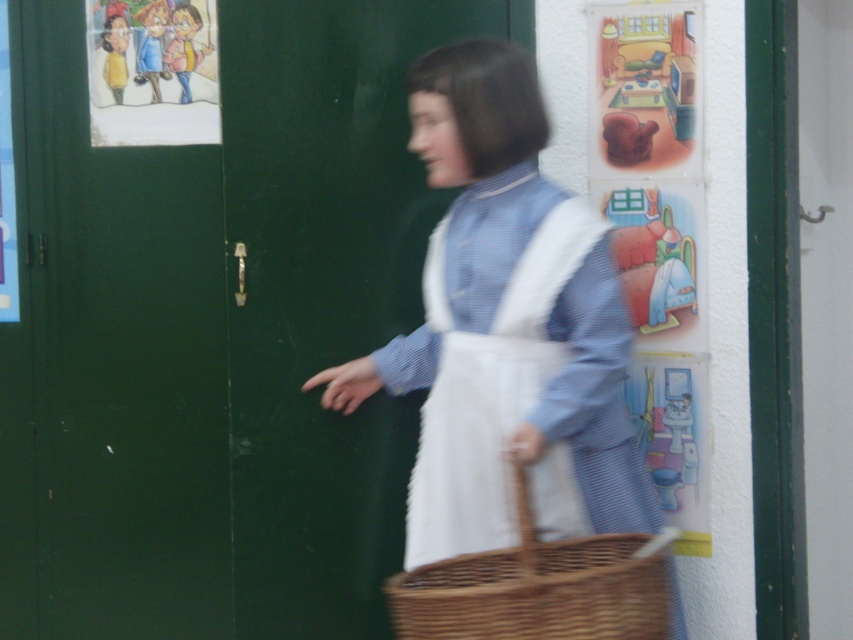
You are a delivery person who needs to place a small package on the floor between the white cotton apron at center and the cartoon paper at upper left. Can you fit it there?

The white cotton apron at center is taller than cartoon paper at upper left, so the space between them might be sufficient for placing the small package, but the exact dimensions are not provided. However, since the apron is taller, it may cast a shadow or occupy more vertical space, potentially limiting horizontal room. Without specific measurements, it is uncertain if the package will fit.

Looking at this image, you are standing in front of the green door and notice two points marked on the wall. Which point, point (537, 420) or point (91, 116), is closer to you?

Point (537, 420) is closer to the viewer than point (91, 116).

You are an interior designer assessing the wall decorations. The wall has two posters next to the green door. The posters are labeled as cartoon paper at upper left and matte plastic poster at upper left. Which poster is wider?

The cartoon paper at upper left is wider than the matte plastic poster at upper left.